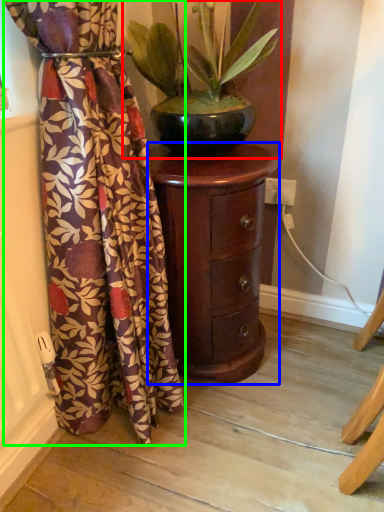
Question: Based on their relative distances, which object is nearer to houseplant (highlighted by a red box)? Choose from furniture (highlighted by a blue box) and curtain (highlighted by a green box).

Choices:
 (A) furniture
 (B) curtain

Answer: (A)